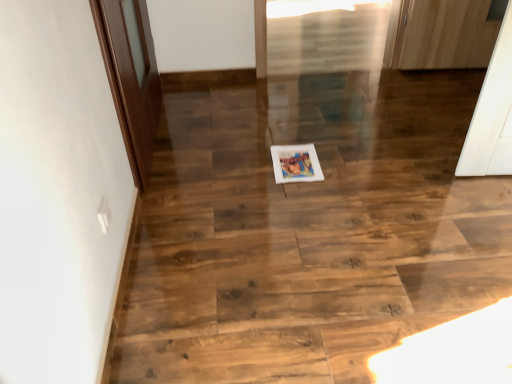
Question: From the image's perspective, is wooden floor at center located above or below matte paper postcard at center?

Choices:
 (A) above
 (B) below

Answer: (B)

Question: In the image, is wooden floor at center positioned in front of or behind matte paper postcard at center?

Choices:
 (A) behind
 (B) front

Answer: (B)

Question: Which object is the closest to the brown wooden door at left?

Choices:
 (A) wooden floor at center
 (B) matte paper postcard at center

Answer: (A)

Question: Estimate the real-world distances between objects in this image. Which object is closer to the wooden floor at center?

Choices:
 (A) brown wooden door at left
 (B) matte paper postcard at center

Answer: (B)